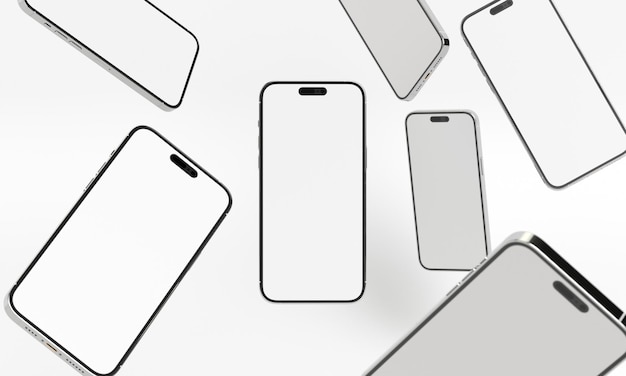
Image resolution: width=626 pixels, height=376 pixels. I want to click on phone, so point(156,55), point(143,235), point(326,210), point(444,219), point(510,358), point(546,123), point(414,49).